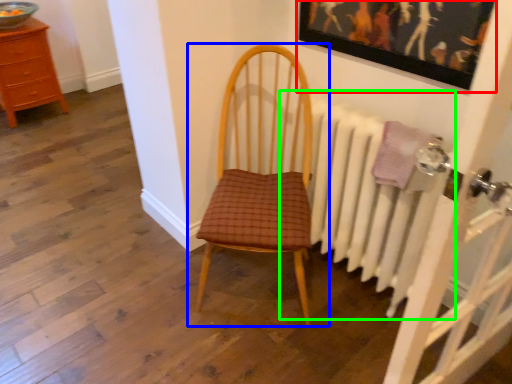
Question: Considering the real-world distances, which object is closest to picture frame (highlighted by a red box)? chair (highlighted by a blue box) or radiator (highlighted by a green box).

Choices:
 (A) chair
 (B) radiator

Answer: (B)